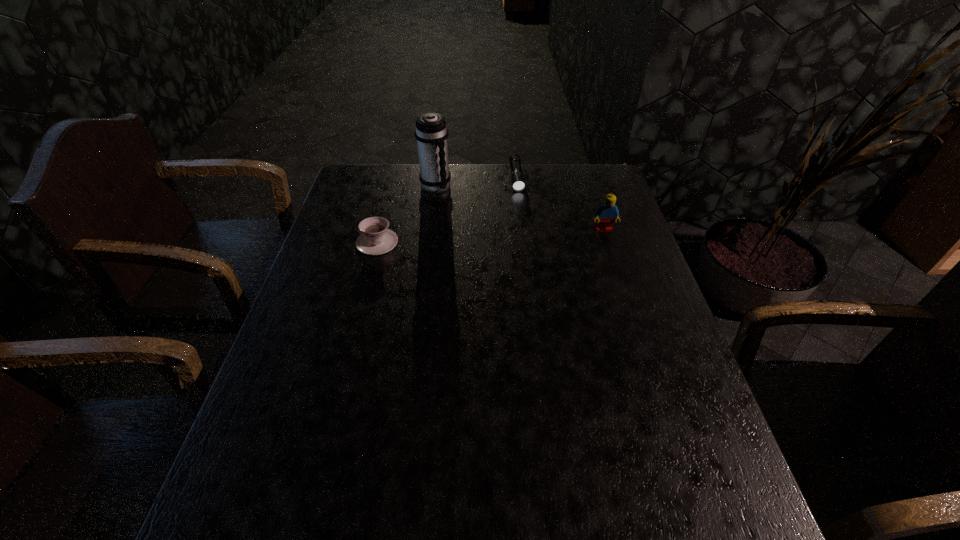
Where is `free point located on the face of the Lego`? This screenshot has width=960, height=540. free point located on the face of the Lego is located at coordinates (616, 267).

Locate an element on the screen. free spot located 0.200m on the side with the handle of the tallest object is located at coordinates (485, 222).

Find the location of a particular element. The image size is (960, 540). vacant space located on the side with the handle of the tallest object is located at coordinates (467, 210).

Find the location of a particular element. The height and width of the screenshot is (540, 960). vacant space situated on the side with the handle of the tallest object is located at coordinates (489, 225).

I want to click on vacant space situated at the lens end of the flashlight, so click(x=521, y=212).

I want to click on free location located 0.380m at the lens end of the flashlight, so click(x=530, y=269).

The image size is (960, 540). What are the coordinates of `vacant region located 0.090m at the lens end of the flashlight` in the screenshot? It's located at (521, 208).

Locate an element on the screen. The width and height of the screenshot is (960, 540). thermos bottle that is at the far edge is located at coordinates (431, 133).

This screenshot has width=960, height=540. Identify the location of flashlight that is at the far edge. (517, 178).

The width and height of the screenshot is (960, 540). What are the coordinates of `object that is at the left edge` in the screenshot? It's located at (376, 239).